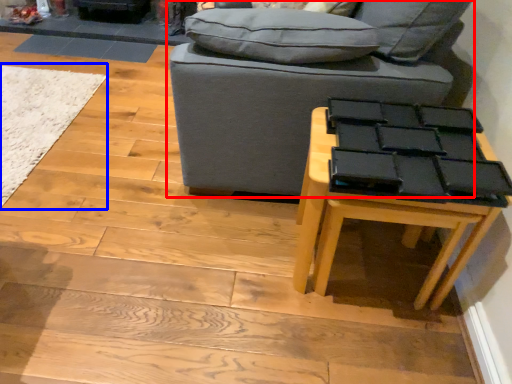
Question: Which point is closer to the camera, studio couch (highlighted by a red box) or mat (highlighted by a blue box)?

Choices:
 (A) studio couch
 (B) mat

Answer: (A)